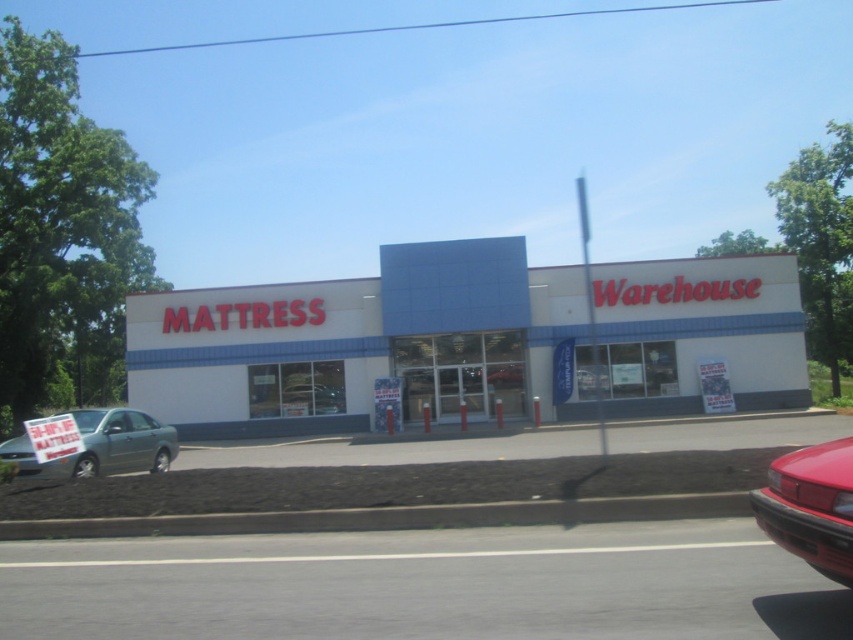
You are a customer driving a shiny red car at lower right and want to park near the matte black mattress sign at lower left. Can you park your car directly in front of the sign?

The shiny red car at lower right is located above the matte black mattress sign at lower left, so it cannot be parked directly in front of the sign since it is positioned higher up in the image.

You are a delivery truck driver who needs to park your truck that is 15 meters long. You see the white matte building at center and the matte black mattress sign at lower left. Which object is wider, and can you park your truck between them?

The white matte building at center is wider than the matte black mattress sign at lower left. However, since the truck is 15 meters long, the space between them may not be sufficient for parking, as the description only mentions the width of the objects, not the distance between them.

You are a delivery truck driver who needs to back up to the white matte building at center to unload a mattress. The truck requires a minimum of 30 meters of clearance to safely maneuver. Can you determine if there is enough space to back up safely?

The white matte building at center is 30.51 meters from the camera, which means there is sufficient space for the delivery truck to safely maneuver as it meets the required 30 meters clearance.